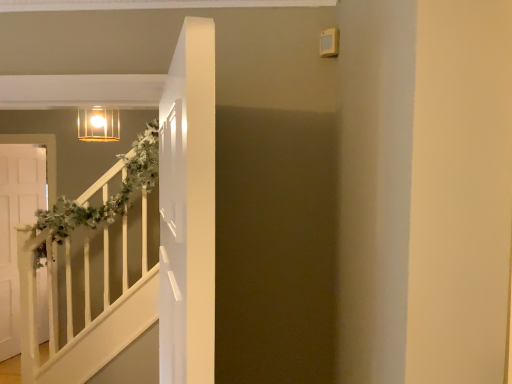
This screenshot has height=384, width=512. Identify the location of white glossy door at center. pyautogui.click(x=188, y=209).

What do you see at coordinates (188, 209) in the screenshot?
I see `white glossy door at center` at bounding box center [188, 209].

You are a GUI agent. You are given a task and a screenshot of the screen. Output one action in this format:
    pyautogui.click(x=<x>, y=<y>)
    Task: Click on the white glossy door at center
    The image size is (512, 384).
    Given the screenshot: What is the action you would take?
    pos(188,209)